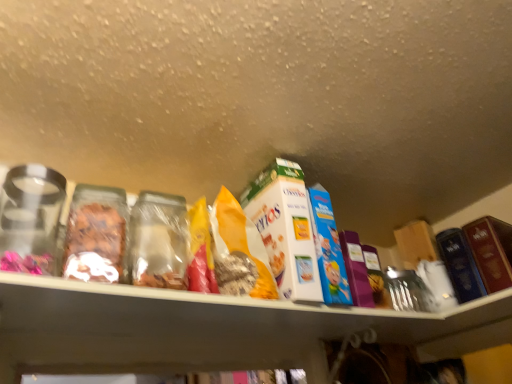
Question: Can you confirm if hardcover book at right, marked as the 1th product in a right-to-left arrangement, is wider than yellow paper bag at center?

Choices:
 (A) yes
 (B) no

Answer: (A)

Question: Can you confirm if hardcover book at right, marked as the 1th product in a right-to-left arrangement, is thinner than yellow paper bag at center?

Choices:
 (A) no
 (B) yes

Answer: (A)

Question: From the image's perspective, would you say hardcover book at right, acting as the 2th product starting from the left, is shown under yellow paper bag at center?

Choices:
 (A) no
 (B) yes

Answer: (B)

Question: Is hardcover book at right, marked as the 1th product in a right-to-left arrangement, smaller than yellow paper bag at center?

Choices:
 (A) no
 (B) yes

Answer: (B)

Question: Would you say hardcover book at right, marked as the 1th product in a right-to-left arrangement, contains yellow paper bag at center?

Choices:
 (A) yes
 (B) no

Answer: (B)

Question: In terms of width, does hardcover book at right, acting as the 2th product starting from the left, look wider or thinner when compared to yellow paper bag at center?

Choices:
 (A) wide
 (B) thin

Answer: (A)

Question: From a real-world perspective, is hardcover book at right, acting as the 2th product starting from the left, above or below yellow paper bag at center?

Choices:
 (A) above
 (B) below

Answer: (B)

Question: From the image's perspective, is hardcover book at right, marked as the 1th product in a right-to-left arrangement, above or below yellow paper bag at center?

Choices:
 (A) above
 (B) below

Answer: (B)

Question: Considering the positions of hardcover book at right, marked as the 1th product in a right-to-left arrangement, and yellow paper bag at center in the image, is hardcover book at right, marked as the 1th product in a right-to-left arrangement, taller or shorter than yellow paper bag at center?

Choices:
 (A) tall
 (B) short

Answer: (B)

Question: From a real-world perspective, is white cardboard cereal box at center, which appears as the 2th product when viewed from the right, above or below yellow paper bag at center?

Choices:
 (A) above
 (B) below

Answer: (A)

Question: From the image's perspective, is white cardboard cereal box at center, which is counted as the first product, starting from the left, located above or below yellow paper bag at center?

Choices:
 (A) below
 (B) above

Answer: (A)

Question: Considering the positions of white cardboard cereal box at center, which appears as the 2th product when viewed from the right, and yellow paper bag at center in the image, is white cardboard cereal box at center, which appears as the 2th product when viewed from the right, wider or thinner than yellow paper bag at center?

Choices:
 (A) wide
 (B) thin

Answer: (A)

Question: In the image, is white cardboard cereal box at center, which is counted as the first product, starting from the left, positioned in front of or behind yellow paper bag at center?

Choices:
 (A) behind
 (B) front

Answer: (A)

Question: From the image's perspective, is hardcover book at right, acting as the 2th product starting from the left, located above or below white cardboard cereal box at center, which appears as the 2th product when viewed from the right?

Choices:
 (A) above
 (B) below

Answer: (B)

Question: Is hardcover book at right, marked as the 1th product in a right-to-left arrangement, bigger or smaller than white cardboard cereal box at center, which is counted as the first product, starting from the left?

Choices:
 (A) big
 (B) small

Answer: (B)